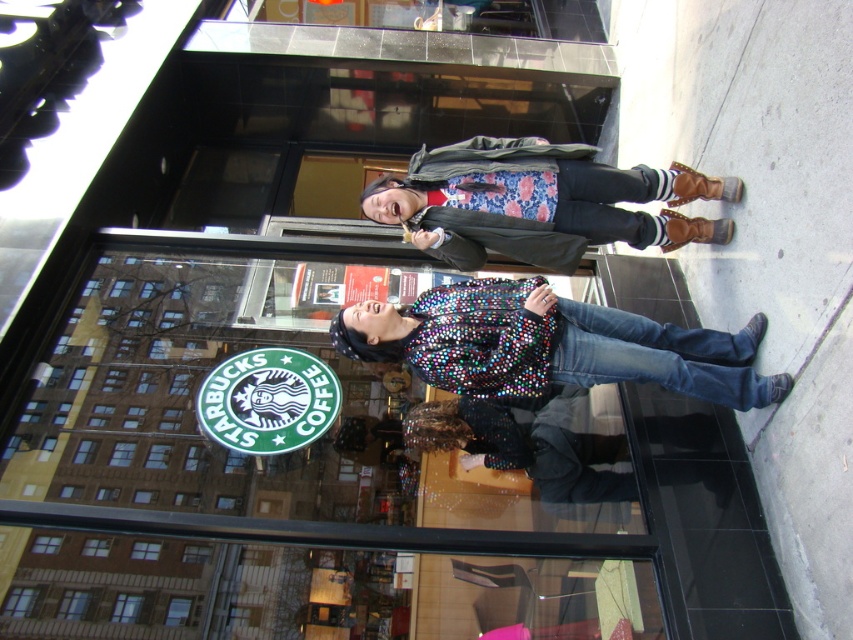
You are a photographer trying to capture both the shiny sequined jacket at center and the floral fabric shirt at center in a single shot. Since you want to ensure both are in focus, which one should you focus on first to maximize clarity for both?

The shiny sequined jacket at center is closer to the viewer than the floral fabric shirt at center, so focusing on the closer object first will help ensure both are in focus as the depth of field extends from the closer object to the farther one.

You are a photographer trying to capture both the shiny sequined jacket at center and the floral fabric shirt at center in one frame. Which clothing item should you focus on first to ensure both are in the frame?

The shiny sequined jacket at center is smaller than the floral fabric shirt at center, so you should focus on the shiny sequined jacket at center first to ensure both are in the frame.